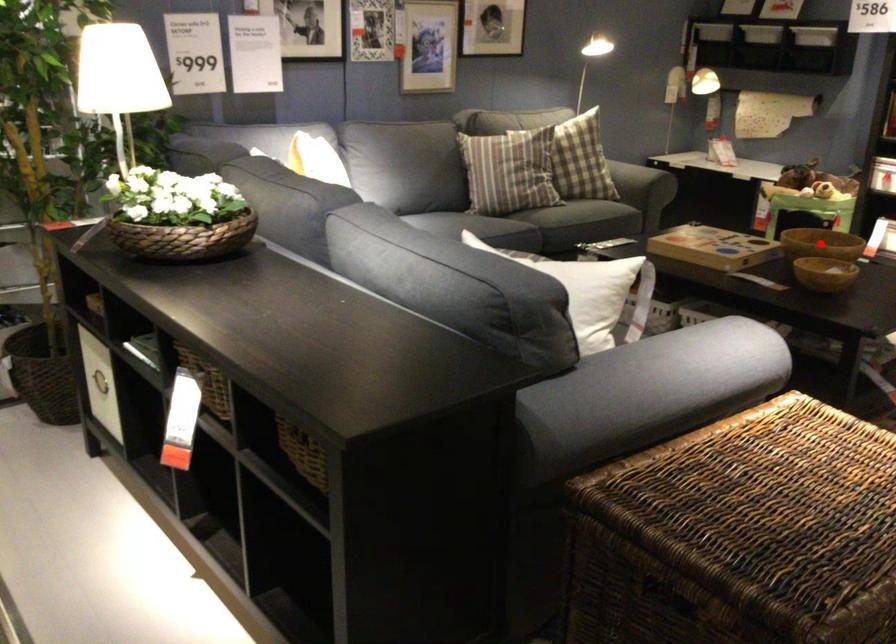
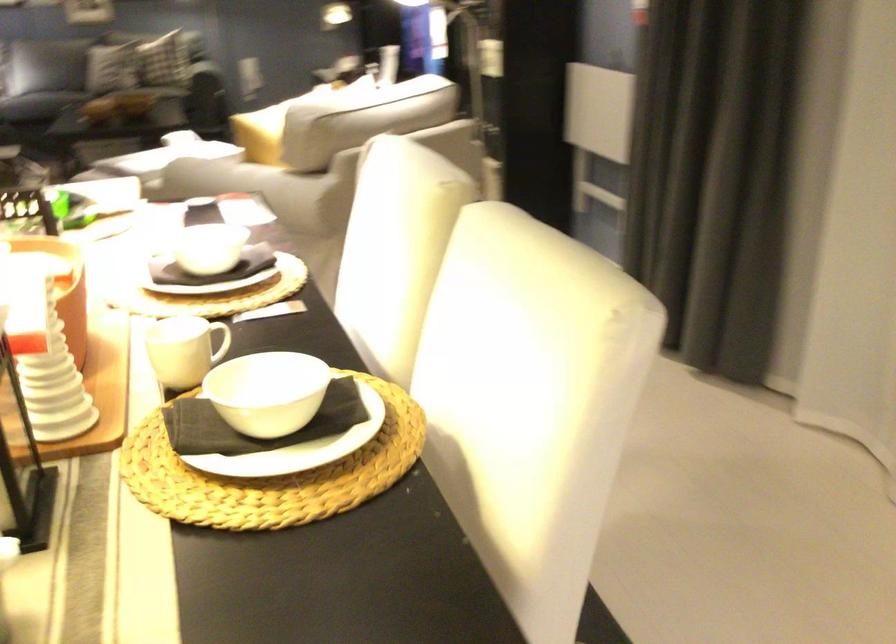
Question: I am providing you with two images of the same scene from different viewpoints. A red point is marked on the first image. Is the red point's position out of view in image 2?

Choices:
 (A) Yes
 (B) No

Answer: (A)